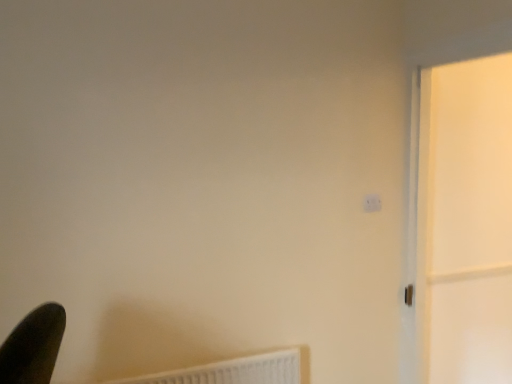
Where is `white glossy screen door at right`? white glossy screen door at right is located at coordinates (465, 222).

What is the approximate width of white glossy screen door at right?

The width of white glossy screen door at right is 5.92 inches.

This screenshot has height=384, width=512. Find the location of `white glossy screen door at right`. white glossy screen door at right is located at coordinates (465, 222).

Is white plastic light switch at upper right situated inside white glossy screen door at right or outside?

white plastic light switch at upper right exists outside the volume of white glossy screen door at right.

Is white plastic light switch at upper right with white glossy screen door at right?

white plastic light switch at upper right is not next to white glossy screen door at right, and they're not touching.

Which object is closer to the camera, white plastic light switch at upper right or white glossy screen door at right?

Positioned in front is white glossy screen door at right.

Is white plastic light switch at upper right positioned with its back to white glossy screen door at right?

white plastic light switch at upper right does not have its back to white glossy screen door at right.

Based on the photo, is white glossy screen door at right positioned behind white plastic light switch at upper right?

No, the depth of white glossy screen door at right is less than that of white plastic light switch at upper right.

Is white glossy screen door at right at the left side of white plastic light switch at upper right?

No, white glossy screen door at right is not to the left of white plastic light switch at upper right.

Locate an element on the screen. The image size is (512, 384). light switch that appears behind the white glossy screen door at right is located at coordinates (372, 203).

From the image's perspective, is white glossy screen door at right below white plastic light switch at upper right?

Yes, from the image's perspective, white glossy screen door at right is beneath white plastic light switch at upper right.

Between white plastic light switch at upper right and white plastic radiator at lower left, which one has more height?

white plastic radiator at lower left.

Between white plastic light switch at upper right and white plastic radiator at lower left, which one is positioned in front?

white plastic radiator at lower left.

Where is `radiator below the white plastic light switch at upper right (from the image's perspective)`? radiator below the white plastic light switch at upper right (from the image's perspective) is located at coordinates (233, 371).

Does white plastic light switch at upper right have a larger size compared to white plastic radiator at lower left?

Incorrect, white plastic light switch at upper right is not larger than white plastic radiator at lower left.

Does white plastic radiator at lower left touch white glossy screen door at right?

white plastic radiator at lower left is not next to white glossy screen door at right, and they're not touching.

Which of these two, white plastic radiator at lower left or white glossy screen door at right, is wider?

With larger width is white glossy screen door at right.

Which object is closer to the camera, white plastic radiator at lower left or white glossy screen door at right?

white glossy screen door at right is closer to the camera.

Which is behind, point (129, 379) or point (496, 310)?

Positioned behind is point (496, 310).

Is white glossy screen door at right oriented towards white plastic radiator at lower left?

Yes, white glossy screen door at right is aimed at white plastic radiator at lower left.

Is white glossy screen door at right outside of white plastic radiator at lower left?

white glossy screen door at right is positioned outside white plastic radiator at lower left.

Is the depth of white glossy screen door at right greater than that of white plastic radiator at lower left?

No, the depth of white glossy screen door at right is less than that of white plastic radiator at lower left.

From the image's perspective, which object appears higher, white glossy screen door at right or white plastic radiator at lower left?

white glossy screen door at right is shown above in the image.

Does white plastic radiator at lower left lie in front of white plastic light switch at upper right?

Yes, white plastic radiator at lower left is closer to the camera.

Does white plastic radiator at lower left have a greater height compared to white plastic light switch at upper right?

Indeed, white plastic radiator at lower left has a greater height compared to white plastic light switch at upper right.

From the image's perspective, which object appears higher, white plastic radiator at lower left or white plastic light switch at upper right?

white plastic light switch at upper right.

Can you confirm if white plastic radiator at lower left is smaller than white plastic light switch at upper right?

Actually, white plastic radiator at lower left might be larger than white plastic light switch at upper right.

At what (x,y) coordinates should I click in order to perform the action: click on light switch above the white glossy screen door at right (from the image's perspective). Please return your answer as a coordinate pair (x, y). Looking at the image, I should click on (372, 203).

Locate an element on the screen. The height and width of the screenshot is (384, 512). screen door that is in front of the white plastic light switch at upper right is located at coordinates (465, 222).

From the picture: Considering their positions, is white glossy screen door at right positioned further to white plastic radiator at lower left than white plastic light switch at upper right?

white glossy screen door at right lies further to white plastic radiator at lower left than the other object.

Based on their spatial positions, is white plastic radiator at lower left or white glossy screen door at right closer to white plastic light switch at upper right?

The object closer to white plastic light switch at upper right is white glossy screen door at right.

Estimate the real-world distances between objects in this image. Which object is further from white glossy screen door at right, white plastic light switch at upper right or white plastic radiator at lower left?

Based on the image, white plastic radiator at lower left appears to be further to white glossy screen door at right.

Which object lies nearer to the anchor point white plastic light switch at upper right, white glossy screen door at right or white plastic radiator at lower left?

white glossy screen door at right.

When comparing their distances from white plastic radiator at lower left, does white plastic light switch at upper right or white glossy screen door at right seem further?

Among the two, white glossy screen door at right is located further to white plastic radiator at lower left.

From the image, which object appears to be farther from white glossy screen door at right, white plastic radiator at lower left or white plastic light switch at upper right?

The object further to white glossy screen door at right is white plastic radiator at lower left.

Image resolution: width=512 pixels, height=384 pixels. What are the coordinates of `light switch between white plastic radiator at lower left and white glossy screen door at right` in the screenshot? It's located at point(372,203).